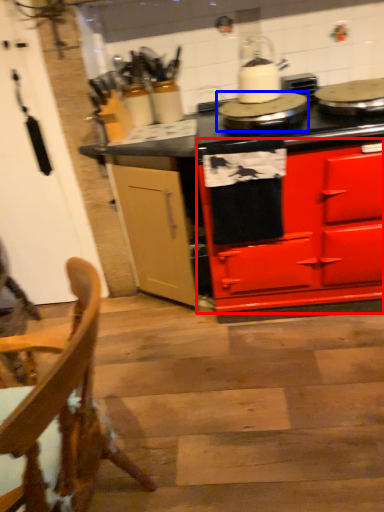
Question: Which of the following is the farthest to the observer, cabinetry (highlighted by a red box) or appliance (highlighted by a blue box)?

Choices:
 (A) cabinetry
 (B) appliance

Answer: (B)